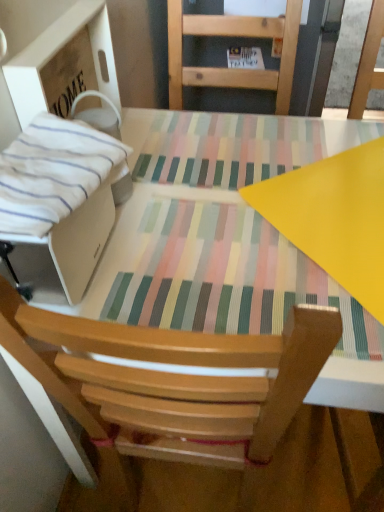
You are a GUI agent. You are given a task and a screenshot of the screen. Output one action in this format:
    pyautogui.click(x=<x>, y=<y>)
    Task: Click on the spots to the right of white cardboard box at left
    The image size is (384, 512).
    Given the screenshot: What is the action you would take?
    pyautogui.click(x=182, y=158)